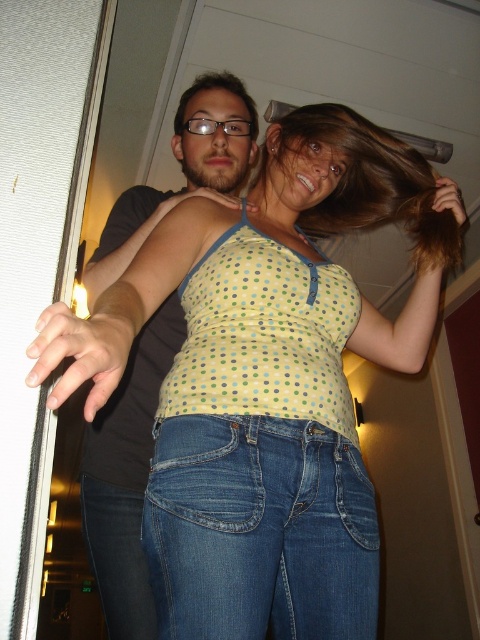
You are a photographer trying to capture a candid shot of the two people in the scene. You want to ensure that both the brown silky hair at upper center and the jeans at lower left are in focus. Given that your camera has a depth of field range of 30 inches, will you need to adjust your focus to include both objects?

The brown silky hair at upper center is 31.03 inches away from the jeans at lower left. Since the distance exceeds the camera depth of field range of 30 inches, you will need to adjust your focus to ensure both objects are in focus.

You are organizing a clothing store and need to arrange the yellow polka dot tank top at center and the matte green tank top at center on a rack. Which tank top should you place first if you want to maximize the number of items displayed on the rack?

The yellow polka dot tank top at center should be placed first because it occupies less space than the matte green tank top at center, allowing more items to fit on the rack.